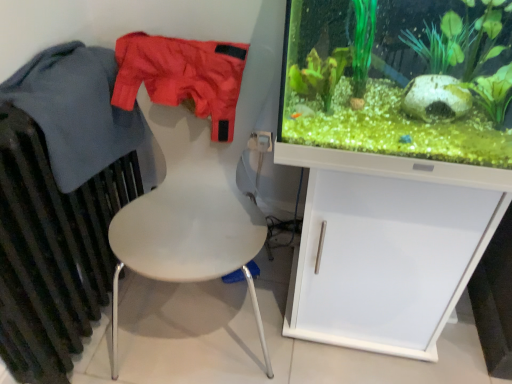
Where is `free space above dark gray metallic radiator at left (from a real-world perspective)`? free space above dark gray metallic radiator at left (from a real-world perspective) is located at coordinates (50, 79).